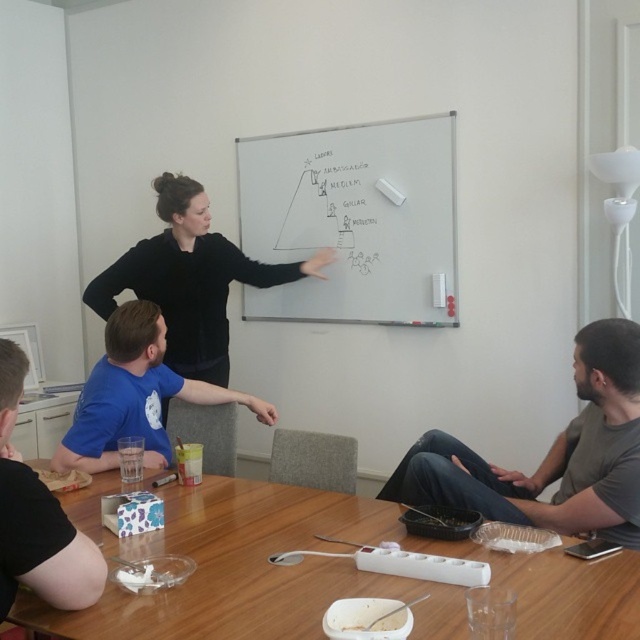
Between whiteboard at upper center and dark gray jeans at lower right, which one appears on the left side from the viewer's perspective?

whiteboard at upper center

Can you confirm if whiteboard at upper center is taller than dark gray jeans at lower right?

Yes, whiteboard at upper center is taller than dark gray jeans at lower right.

Is point (246, 300) positioned before point (580, 513)?

No, (246, 300) is further to viewer.

Locate an element on the screen. This screenshot has height=640, width=640. whiteboard at upper center is located at coordinates (355, 220).

Which of these two, wooden table at lower center or black matte/blackboard at upper center, stands shorter?

Standing shorter between the two is wooden table at lower center.

Is point (406, 595) more distant than point (152, 264)?

That is False.

Between point (554, 550) and point (173, 241), which one is positioned in front?

Point (554, 550) is more forward.

Identify the location of wooden table at lower center. (316, 572).

Who is positioned more to the left, black matte/blackboard at upper center or blue t-shirt at center?

blue t-shirt at center

Who is higher up, black matte/blackboard at upper center or blue t-shirt at center?

black matte/blackboard at upper center

Which is behind, point (220, 328) or point (104, 355)?

Point (220, 328)

The height and width of the screenshot is (640, 640). I want to click on black matte/blackboard at upper center, so click(x=189, y=280).